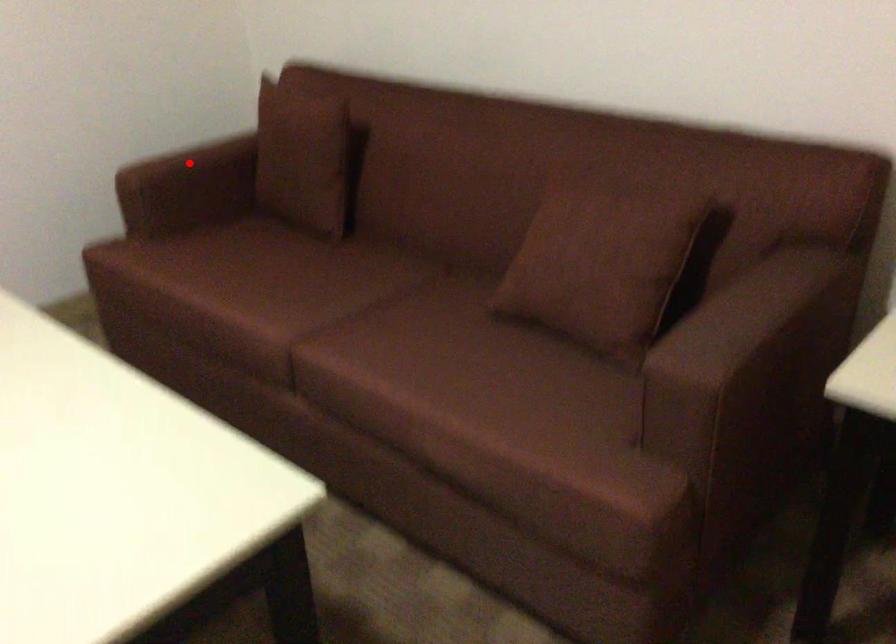
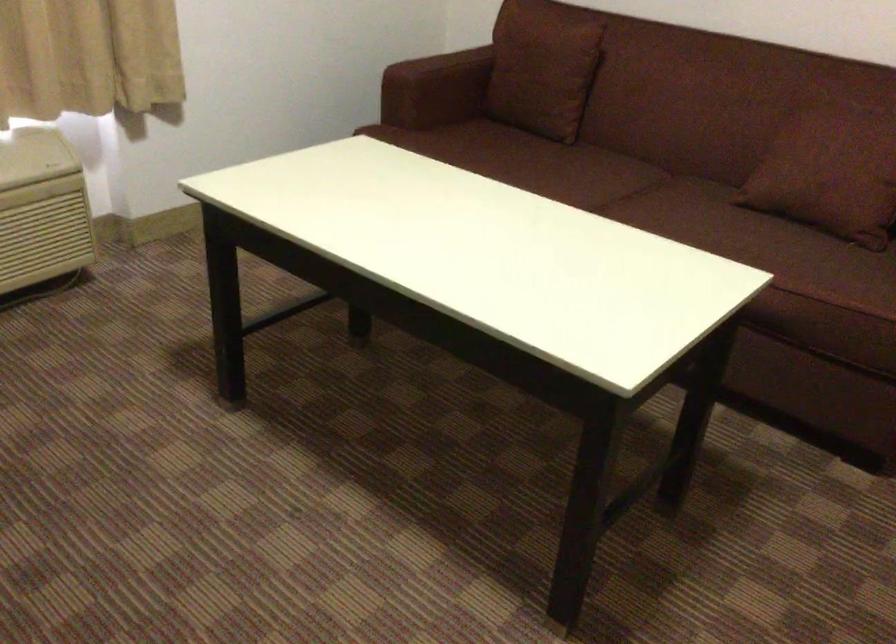
Where in the second image is the point corresponding to the highlighted location from the first image?

(441, 66)